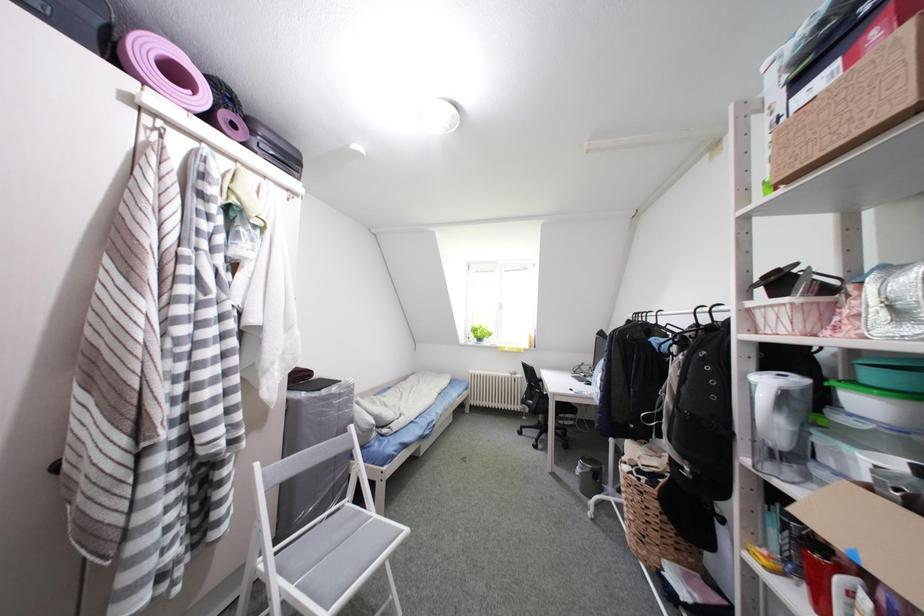
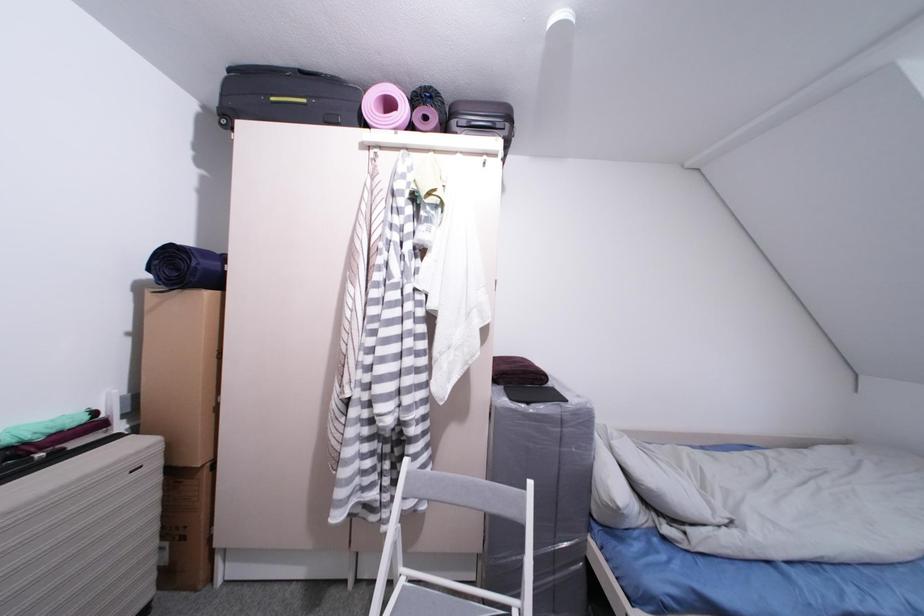
Question: The camera is either moving clockwise (left) or counter-clockwise (right) around the object. The first image is from the beginning of the video and the second image is from the end. Is the camera moving left or right when shooting the video?

Choices:
 (A) Left
 (B) Right

Answer: (B)